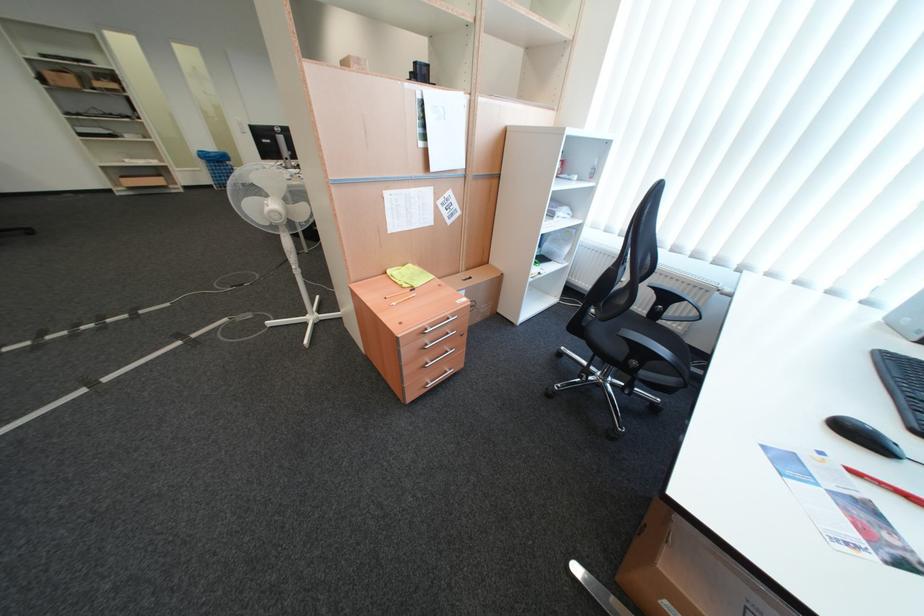
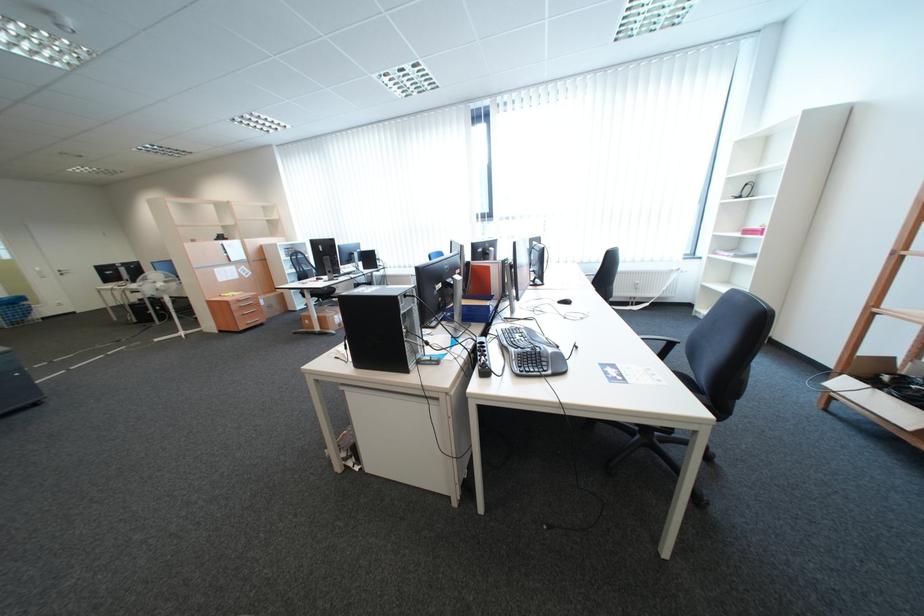
Locate, in the second image, the point that corresponds to [412,347] in the first image.

(242, 305)